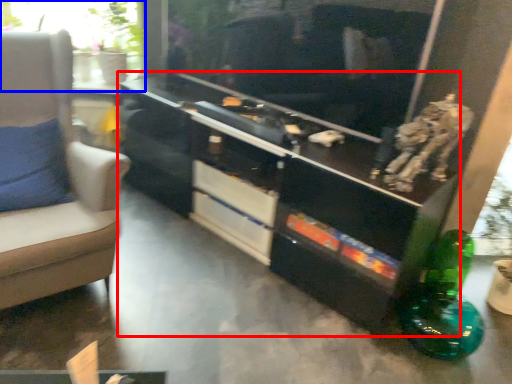
Question: Which object appears closest to the camera in this image, entertainment center (highlighted by a red box) or window (highlighted by a blue box)?

Choices:
 (A) entertainment center
 (B) window

Answer: (A)